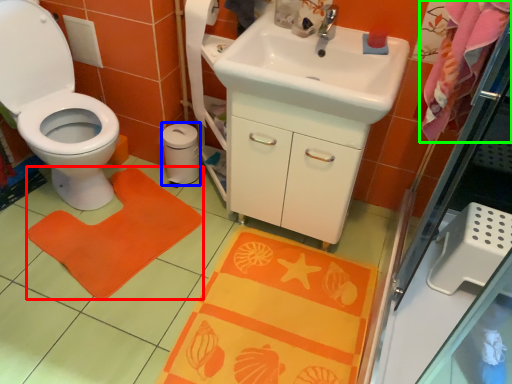
Question: Based on their relative distances, which object is farther from doormat (highlighted by a red box)? Choose from toilet paper (highlighted by a blue box) and beach towel (highlighted by a green box).

Choices:
 (A) toilet paper
 (B) beach towel

Answer: (B)